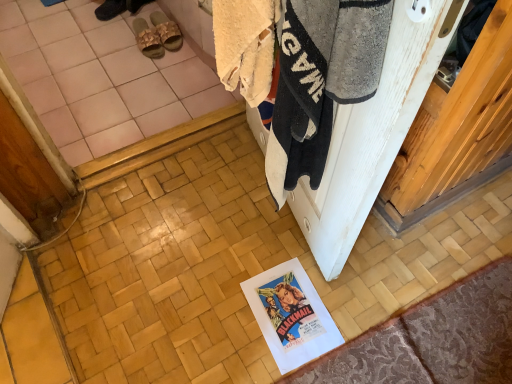
I want to click on vacant space to the left of white wood screen door at upper right, so click(x=229, y=226).